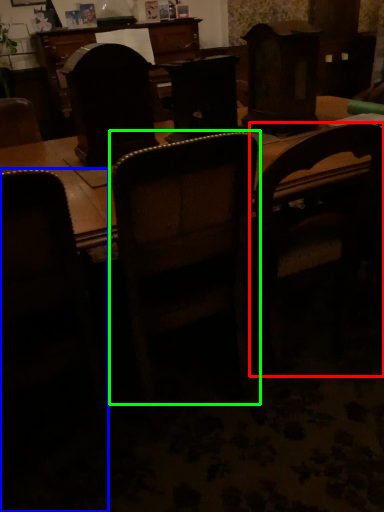
Question: Which object is positioned closest to chair (highlighted by a red box)? Select from chair (highlighted by a blue box) and chair (highlighted by a green box).

Choices:
 (A) chair
 (B) chair

Answer: (B)